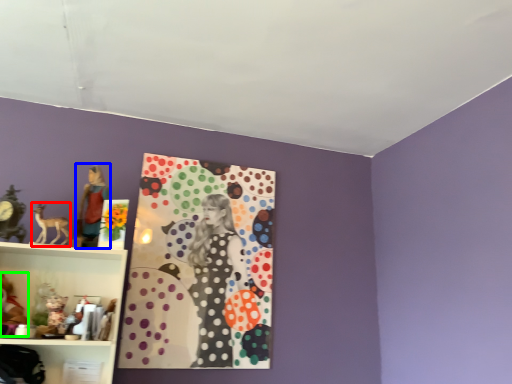
Question: Which is farther away from animal (highlighted by a red box)? person (highlighted by a blue box) or toy (highlighted by a green box)?

Choices:
 (A) person
 (B) toy

Answer: (B)